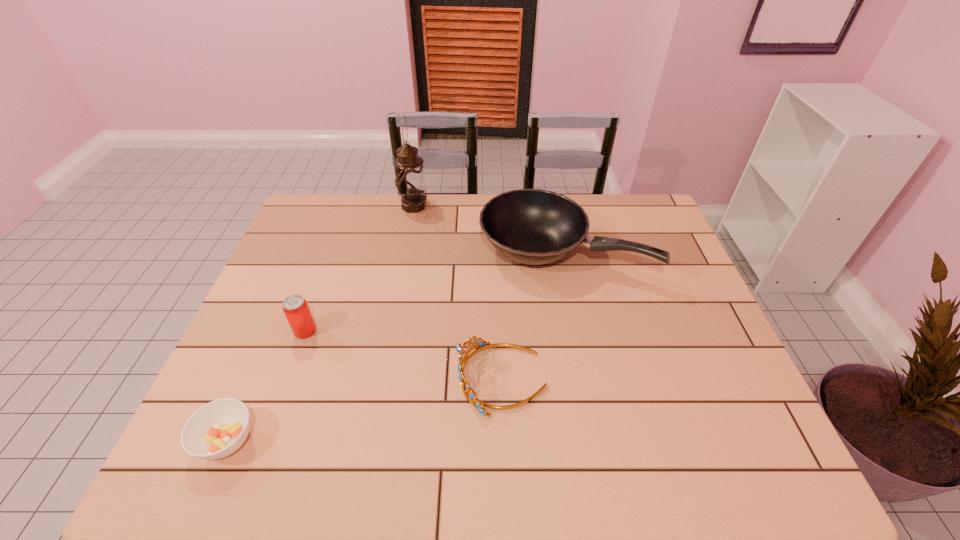
Identify the location of object at the far right corner. (530, 226).

Where is `vacant space at the far edge of the desktop`? vacant space at the far edge of the desktop is located at coordinates tap(362, 198).

At what (x,y) coordinates should I click in order to perform the action: click on vacant region at the near edge of the desktop. Please return your answer as a coordinate pair (x, y). The image size is (960, 540). Looking at the image, I should click on pos(669,449).

You are a GUI agent. You are given a task and a screenshot of the screen. Output one action in this format:
    pyautogui.click(x=<x>, y=<y>)
    Task: Click on the free space at the left edge
    The image size is (960, 540).
    Given the screenshot: What is the action you would take?
    pyautogui.click(x=264, y=393)

Where is `vacant area at the right edge`? vacant area at the right edge is located at coordinates (737, 395).

Find the location of a particular element. This screenshot has height=540, width=960. vacant point at the far left corner is located at coordinates (348, 208).

You are a GUI agent. You are given a task and a screenshot of the screen. Output one action in this format:
    pyautogui.click(x=<x>, y=<y>)
    Task: Click on the free space at the far right corner of the desktop
    This screenshot has width=960, height=540.
    Given the screenshot: What is the action you would take?
    pyautogui.click(x=660, y=222)

Identify the location of free space between the can and the frying pan. The image size is (960, 540). (434, 291).

This screenshot has width=960, height=540. In order to click on vacant space in between the tiara and the fourth nearest object in this screenshot , I will do `click(533, 315)`.

Locate an element on the screen. The height and width of the screenshot is (540, 960). free spot between the tiara and the third farthest object is located at coordinates (403, 355).